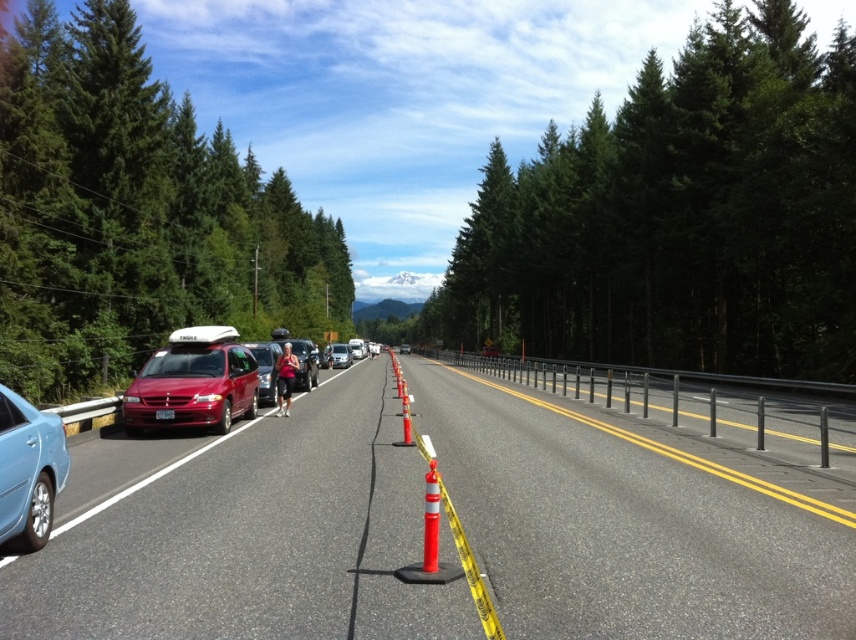
You are a pedestrian wanting to cross the road safely. You see a green leafy tree at left and a matte red van at center. Which object is closer to you as you stand on the sidewalk?

The green leafy tree at left is closer to you because it is larger in size than the matte red van at center, indicating proximity due to perspective.